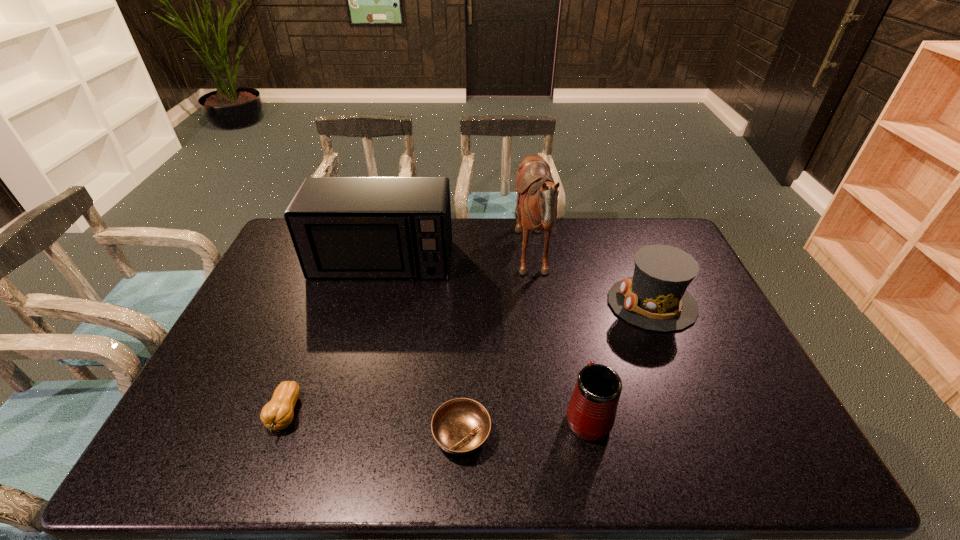
Locate an element on the screen. This screenshot has width=960, height=540. the tallest object is located at coordinates (537, 195).

Find the location of `the second tallest object`. the second tallest object is located at coordinates (341, 227).

You are a GUI agent. You are given a task and a screenshot of the screen. Output one action in this format:
    pyautogui.click(x=<x>, y=<y>)
    Task: Click on the dress hat
    Image resolution: width=960 pixels, height=540 pixels.
    Given the screenshot: What is the action you would take?
    pyautogui.click(x=655, y=298)

Image resolution: width=960 pixels, height=540 pixels. I want to click on mug, so click(591, 412).

Locate an element on the screen. the fifth tallest object is located at coordinates (277, 414).

Find the location of a particular element. The width and height of the screenshot is (960, 540). soup bowl is located at coordinates (460, 426).

In order to click on free space located 0.360m on the back of the tallest object in this screenshot , I will do `click(410, 262)`.

This screenshot has width=960, height=540. Find the location of `vacant space located 0.050m on the back of the tallest object`. vacant space located 0.050m on the back of the tallest object is located at coordinates 499,262.

Locate an element on the screen. vacant position located on the back of the tallest object is located at coordinates (488, 262).

You are a GUI agent. You are given a task and a screenshot of the screen. Output one action in this format:
    pyautogui.click(x=<x>, y=<y>)
    Task: Click on the free region located on the front-facing side of the second tallest object
    Image resolution: width=960 pixels, height=540 pixels.
    Given the screenshot: What is the action you would take?
    pyautogui.click(x=349, y=381)